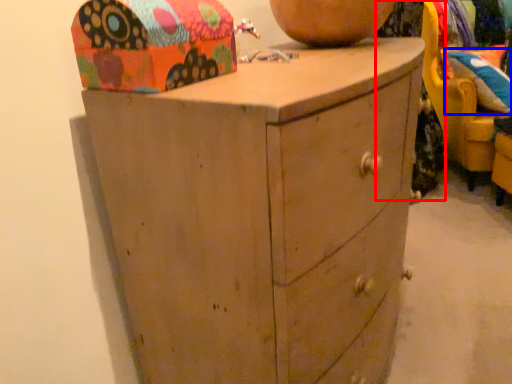
Question: Which of the following is the closest to the observer, clothing (highlighted by a red box) or pillow (highlighted by a blue box)?

Choices:
 (A) clothing
 (B) pillow

Answer: (A)